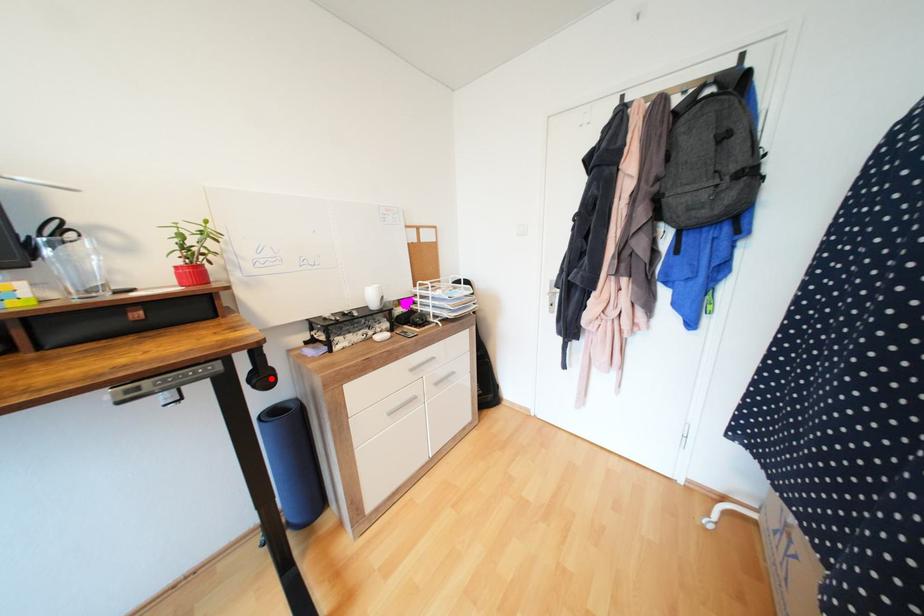
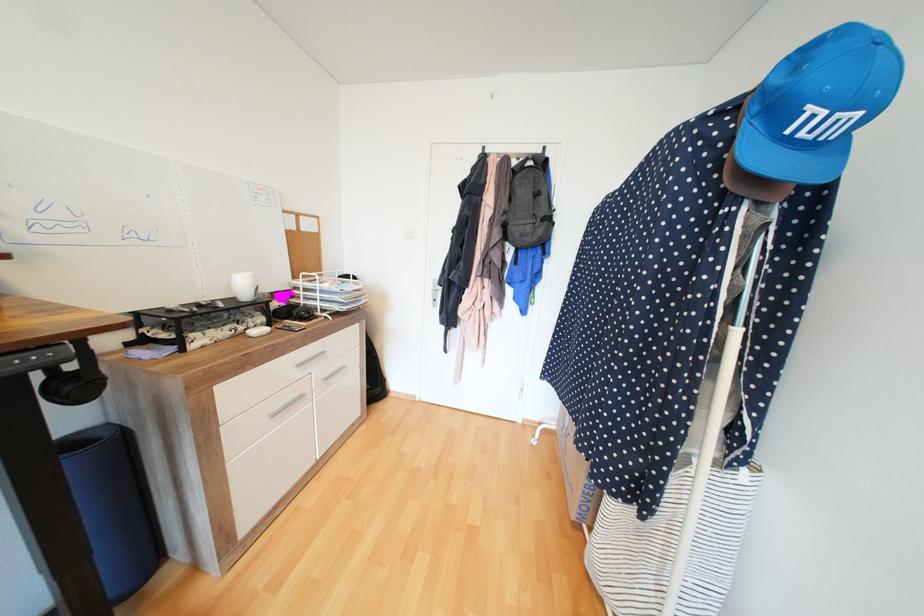
In the second image, find the point that corresponds to the highlighted location in the first image.

(88, 387)